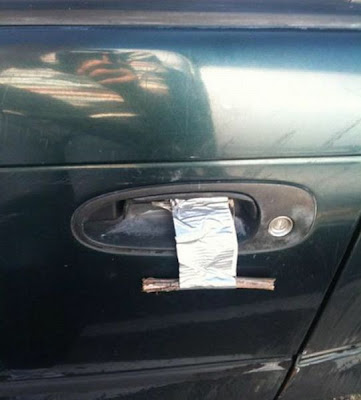
This screenshot has height=400, width=361. Identify the location of green paint. (39, 296).